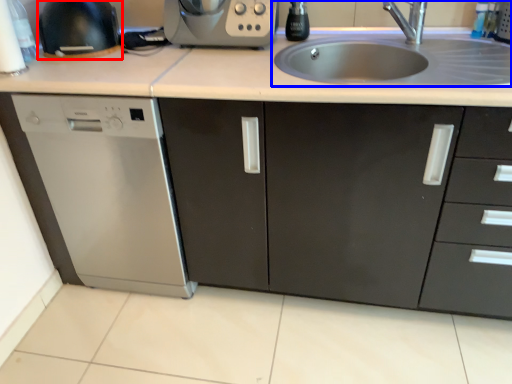
Question: Among these objects, which one is farthest to the camera, appliance (highlighted by a red box) or sink (highlighted by a blue box)?

Choices:
 (A) appliance
 (B) sink

Answer: (A)